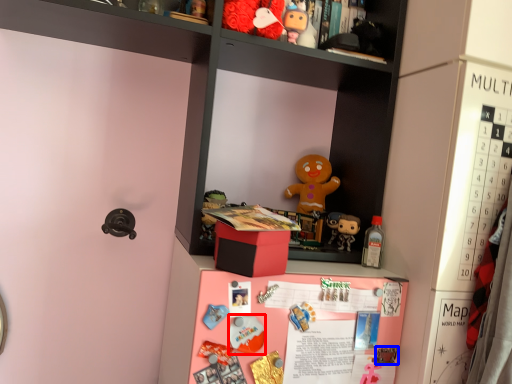
Question: Which of the following is the farthest to the observer, toy (highlighted by a red box) or toy (highlighted by a blue box)?

Choices:
 (A) toy
 (B) toy

Answer: (B)